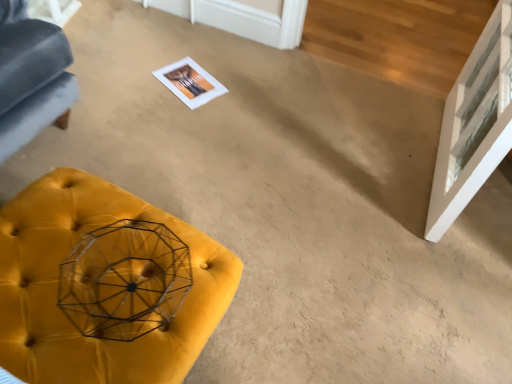
Locate an element on the screen. This screenshot has height=384, width=512. vacant point above velvet yellow ottoman at lower left (from a real-world perspective) is located at coordinates (91, 264).